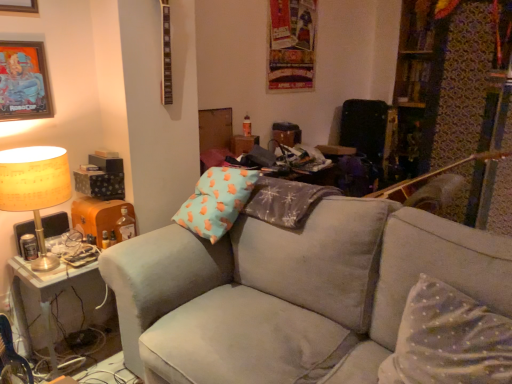
Question: Is metallic picture frame at upper left, the 1th picture frame from the top, bigger or smaller than suede gray couch at center?

Choices:
 (A) big
 (B) small

Answer: (B)

Question: Is point (18, 6) closer or farther from the camera than point (236, 286)?

Choices:
 (A) closer
 (B) farther

Answer: (A)

Question: Which object is positioned closest to the white dotted fabric pillow at lower right?

Choices:
 (A) metallic picture frame at upper left, the 1th picture frame from the top
 (B) suede gray couch at center
 (C) matte yellow fabric lampshade at left
 (D) metallic silver picture frame at upper left, which is the 1th picture frame in bottom-to-top order
 (E) metallic brass table at lower left

Answer: (B)

Question: Based on their relative distances, which object is nearer to the metallic silver picture frame at upper left, which ranks as the second picture frame in top-to-bottom order?

Choices:
 (A) white dotted fabric pillow at lower right
 (B) metallic brass table at lower left
 (C) matte yellow fabric lampshade at left
 (D) suede gray couch at center
 (E) metallic picture frame at upper left, the 1th picture frame from the top

Answer: (E)